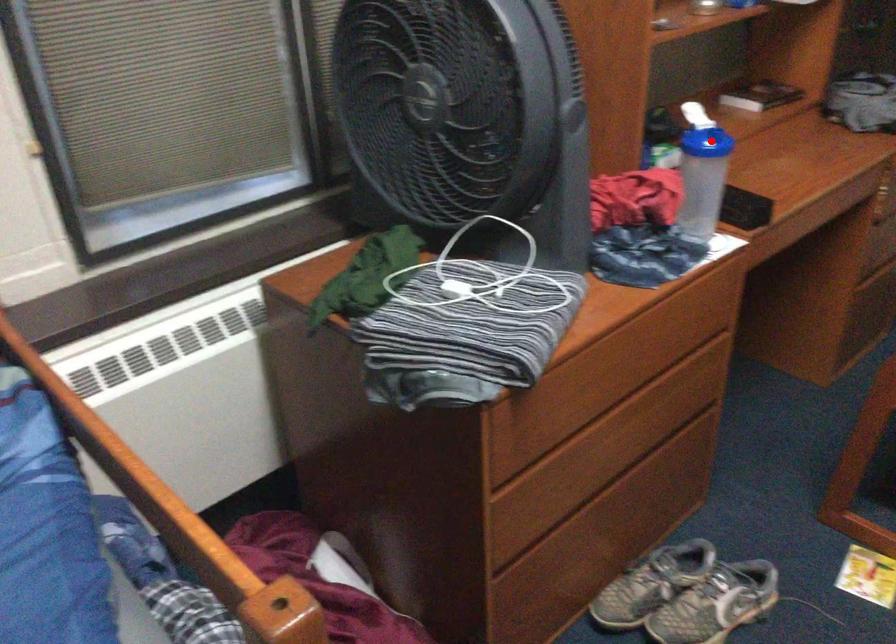
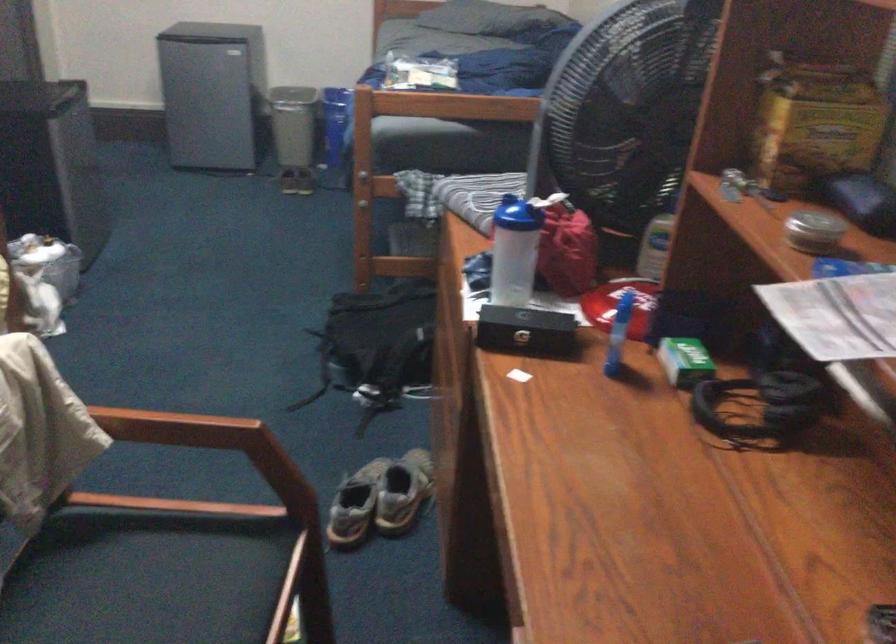
Locate, in the second image, the point that corresponds to the highlighted location in the first image.

(510, 214)